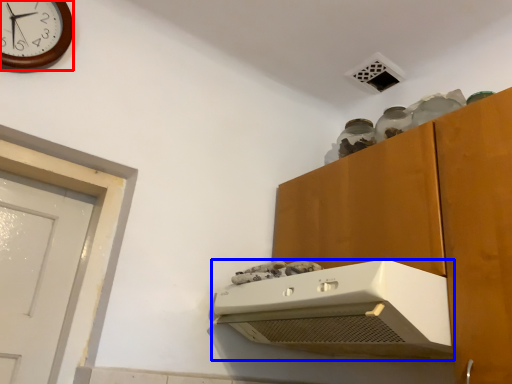
Question: Which object appears closest to the camera in this image, wall clock (highlighted by a red box) or home appliance (highlighted by a blue box)?

Choices:
 (A) wall clock
 (B) home appliance

Answer: (B)